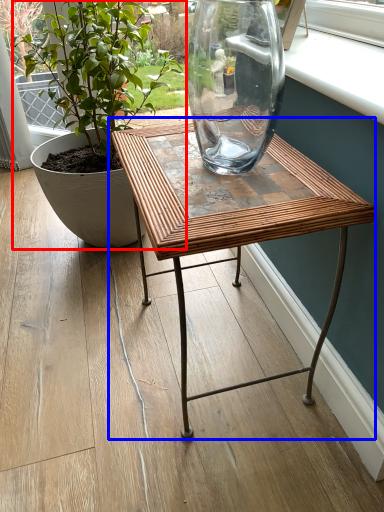
Question: Among these objects, which one is nearest to the camera, houseplant (highlighted by a red box) or table (highlighted by a blue box)?

Choices:
 (A) houseplant
 (B) table

Answer: (B)